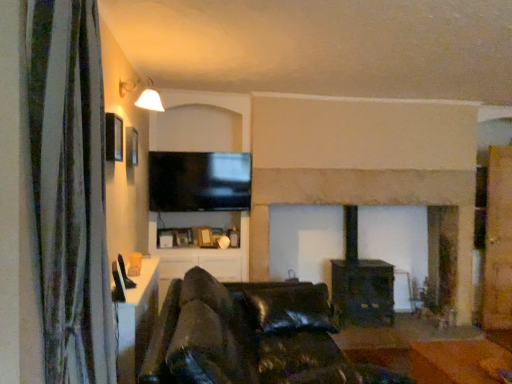
What do you see at coordinates (456, 361) in the screenshot?
I see `orange leather couch at lower center` at bounding box center [456, 361].

Locate an element on the screen. The height and width of the screenshot is (384, 512). black leather couch at center is located at coordinates (250, 336).

From the image's perspective, is black leather couch at center below stone fireplace at center?

Yes.

Is stone fireplace at center at the back of black leather couch at center?

No, black leather couch at center's orientation is not away from stone fireplace at center.

From a real-world perspective, between black leather couch at center and stone fireplace at center, who is vertically lower?

black leather couch at center.

Which is more to the right, black leather couch at center or stone fireplace at center?

From the viewer's perspective, stone fireplace at center appears more on the right side.

Which object is closer to the camera, stone fireplace at center or black glossy tv at upper center?

black glossy tv at upper center is in front.

Which is more to the right, stone fireplace at center or black glossy tv at upper center?

stone fireplace at center.

You are a GUI agent. You are given a task and a screenshot of the screen. Output one action in this format:
    pyautogui.click(x=<x>, y=<y>)
    Task: Click on the television in front of the stone fireplace at center
    
    Given the screenshot: What is the action you would take?
    click(x=199, y=181)

Which of these two, orange leather couch at lower center or matte white lampshade at upper left, stands shorter?

matte white lampshade at upper left is shorter.

Where is `light fixture above the orange leather couch at lower center (from a real-world perspective)`? The width and height of the screenshot is (512, 384). light fixture above the orange leather couch at lower center (from a real-world perspective) is located at coordinates point(150,98).

Is orange leather couch at lower center situated inside matte white lampshade at upper left or outside?

orange leather couch at lower center exists outside the volume of matte white lampshade at upper left.

Between matte white lampshade at upper left and orange leather couch at lower center, which one appears on the left side from the viewer's perspective?

matte white lampshade at upper left is more to the left.

From a real-world perspective, between matte white lampshade at upper left and orange leather couch at lower center, who is vertically lower?

orange leather couch at lower center.

Is matte white lampshade at upper left further to the viewer compared to orange leather couch at lower center?

Yes, matte white lampshade at upper left is further from the viewer.

Is matte white lampshade at upper left touching orange leather couch at lower center?

No, matte white lampshade at upper left is not touching orange leather couch at lower center.

From the picture: Considering the relative positions of black glossy tv at upper center and orange leather couch at lower center in the image provided, is black glossy tv at upper center to the left or to the right of orange leather couch at lower center?

black glossy tv at upper center is positioned on orange leather couch at lower center's left side.

From the image's perspective, who appears lower, black glossy tv at upper center or orange leather couch at lower center?

From the image's view, orange leather couch at lower center is below.

Considering the sizes of objects black glossy tv at upper center and orange leather couch at lower center in the image provided, who is bigger, black glossy tv at upper center or orange leather couch at lower center?

Bigger between the two is orange leather couch at lower center.

From a real-world perspective, between black leather couch at center and green fabric curtain at left, who is vertically lower?

black leather couch at center is physically lower.

How much distance is there between black leather couch at center and green fabric curtain at left?

37.13 inches.

I want to click on studio couch below the green fabric curtain at left (from a real-world perspective), so click(250, 336).

Is point (182, 373) positioned before point (36, 83)?

No, it is behind (36, 83).

Is point (139, 102) closer to camera compared to point (103, 274)?

No.

From the image's perspective, is matte white lampshade at upper left located above or below green fabric curtain at left?

matte white lampshade at upper left is situated higher than green fabric curtain at left in the image.

Consider the image. Is matte white lampshade at upper left aimed at green fabric curtain at left?

No, matte white lampshade at upper left is not facing towards green fabric curtain at left.

Considering the relative sizes of matte white lampshade at upper left and green fabric curtain at left in the image provided, is matte white lampshade at upper left shorter than green fabric curtain at left?

Yes, matte white lampshade at upper left is shorter than green fabric curtain at left.

In order to click on fireplace on the right side of black leather couch at center in this screenshot , I will do click(364, 163).

In the image, there is a stone fireplace at center. Where is `television above it (from the image's perspective)`? television above it (from the image's perspective) is located at coordinates (199, 181).

Based on their spatial positions, is black glossy tv at upper center or matte white lampshade at upper left closer to green fabric curtain at left?

matte white lampshade at upper left.

Looking at the image, which one is located closer to black leather couch at center, stone fireplace at center or black glossy tv at upper center?

The object closer to black leather couch at center is black glossy tv at upper center.

Looking at the image, which one is located closer to matte white lampshade at upper left, orange leather couch at lower center or stone fireplace at center?

stone fireplace at center is closer to matte white lampshade at upper left.

In the scene shown: From the image, which object appears to be farther from matte white lampshade at upper left, black glossy tv at upper center or black leather couch at center?

black leather couch at center lies further to matte white lampshade at upper left than the other object.

Based on the photo, looking at the image, which one is located further to stone fireplace at center, orange leather couch at lower center or green fabric curtain at left?

The object further to stone fireplace at center is green fabric curtain at left.

Considering their positions, is black glossy tv at upper center positioned further to stone fireplace at center than black leather couch at center?

The object further to stone fireplace at center is black leather couch at center.

Looking at this image, when comparing their distances from matte white lampshade at upper left, does stone fireplace at center or black leather couch at center seem further?

Based on the image, stone fireplace at center appears to be further to matte white lampshade at upper left.

Estimate the real-world distances between objects in this image. Which object is closer to black glossy tv at upper center, matte white lampshade at upper left or black leather couch at center?

matte white lampshade at upper left lies closer to black glossy tv at upper center than the other object.

Locate an element on the screen. studio couch between green fabric curtain at left and orange leather couch at lower center from left to right is located at coordinates (250, 336).

The width and height of the screenshot is (512, 384). In order to click on television located between matte white lampshade at upper left and orange leather couch at lower center in the left-right direction in this screenshot , I will do `click(199, 181)`.

Find the location of `furniture positioned between black leather couch at center and stone fireplace at center from near to far`. furniture positioned between black leather couch at center and stone fireplace at center from near to far is located at coordinates (456, 361).

The height and width of the screenshot is (384, 512). In order to click on curtain between matte white lampshade at upper left and black leather couch at center in the vertical direction in this screenshot , I will do `click(70, 189)`.